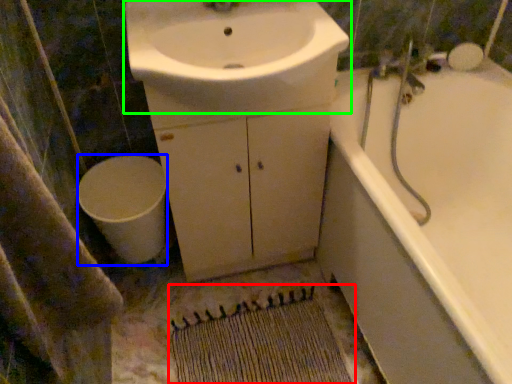
Question: Which is farther away from doormat (highlighted by a red box)? toilet (highlighted by a blue box) or sink (highlighted by a green box)?

Choices:
 (A) toilet
 (B) sink

Answer: (B)